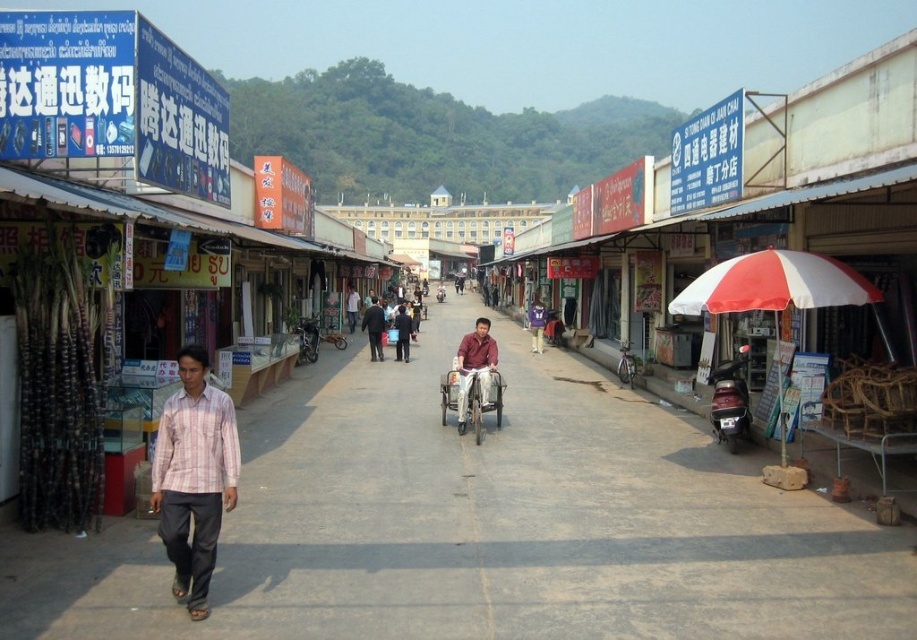
You are a customer at the market and want to ask for directions. You notice two people wearing a matte red shirt at center and a light brown shirt at center. Which person should you approach if you want to ask someone taller?

The matte red shirt at center is much taller than the light brown shirt at center, so you should approach the person wearing the matte red shirt at center.